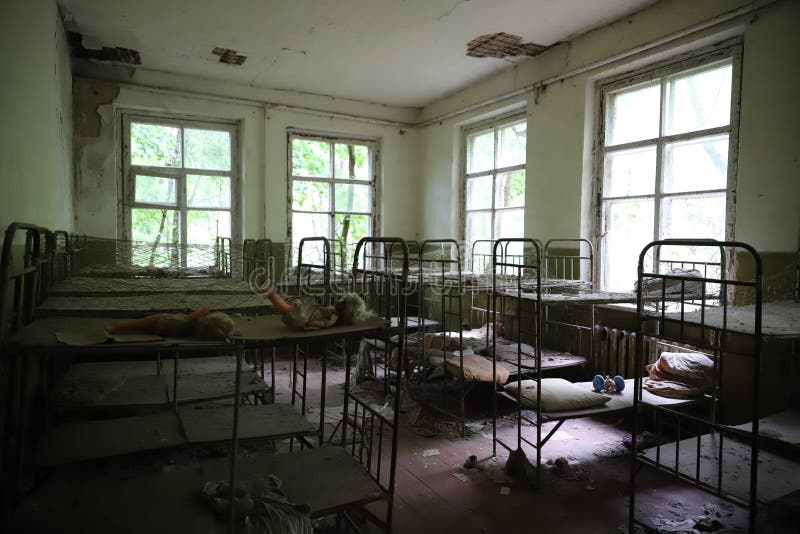
Show me all visible where the bed rests on the floor in the image. Your answer should be formatted as a list of tuples, i.e. [(x1, y1), (x2, y2), ...], where each tuple contains the x and y coordinates of a point satisfying the conditions above.

[(490, 454), (537, 488), (462, 430), (629, 528)]